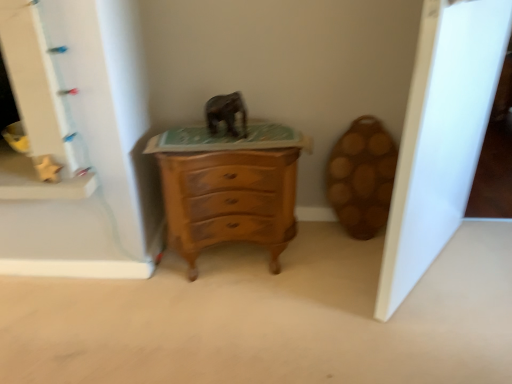
Where is `vacant area that is in front of wooden chest of drawers at center`? Image resolution: width=512 pixels, height=384 pixels. vacant area that is in front of wooden chest of drawers at center is located at coordinates (228, 317).